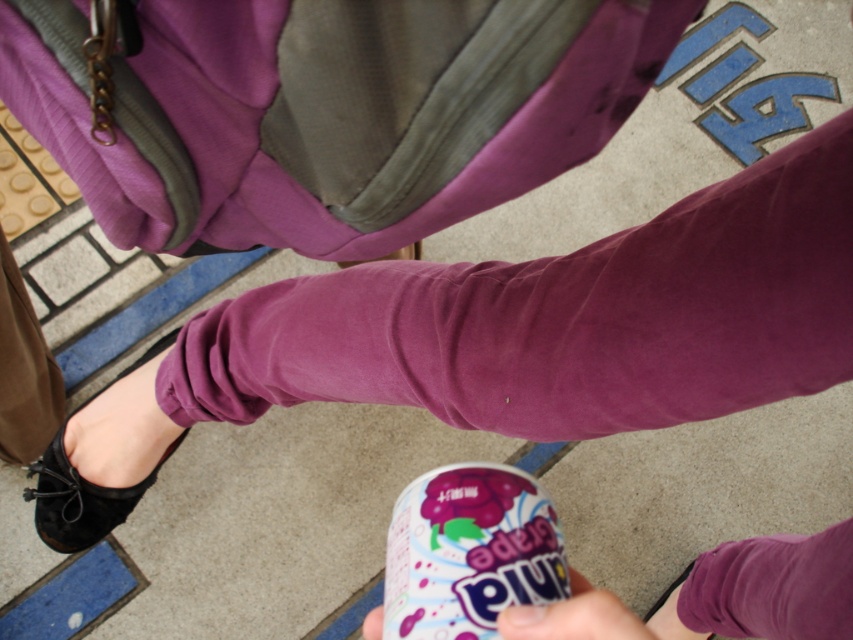
You are trying to reach the pink matte can at lower center without touching the black suede shoe at lower left. Is this possible based on their positions?

The black suede shoe at lower left is closer to you than the pink matte can at lower center, so you would have to move the shoe to reach the can without touching it.

From the picture: You are standing in front of the person in the image. Based on the coordinates provided, can you identify which object is located at the point marked as (85, 484)?

The point marked as (85, 484) corresponds to the black suede shoe at lower left.